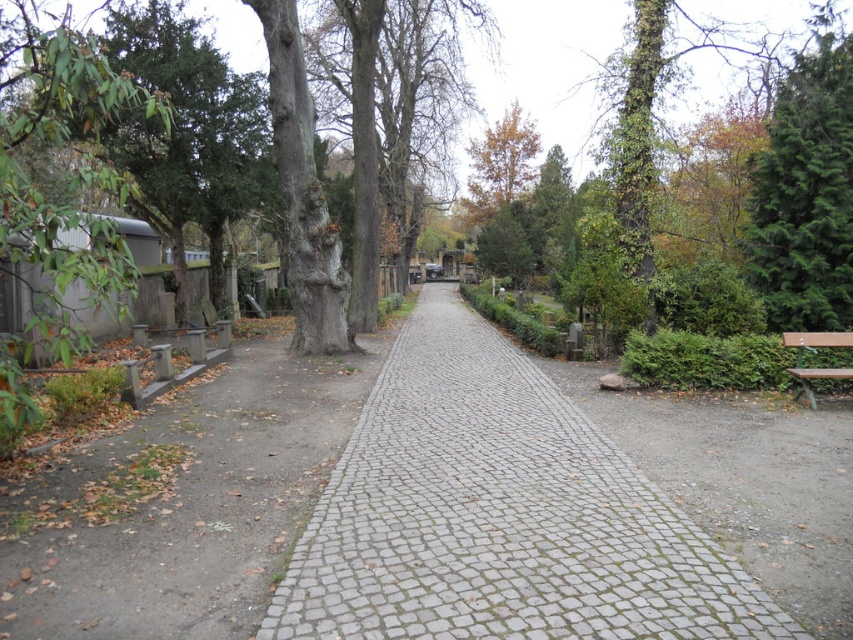
Does gray cobblestone path at center have a lesser height compared to green textured evergreen tree at right?

Yes, gray cobblestone path at center is shorter than green textured evergreen tree at right.

Is gray cobblestone path at center closer to the viewer compared to green textured evergreen tree at right?

Yes, gray cobblestone path at center is in front of green textured evergreen tree at right.

Between point (531, 396) and point (839, 145), which one is positioned in front?

Positioned in front is point (531, 396).

You are a GUI agent. You are given a task and a screenshot of the screen. Output one action in this format:
    pyautogui.click(x=<x>, y=<y>)
    Task: Click on the gray cobblestone path at center
    
    Given the screenshot: What is the action you would take?
    pyautogui.click(x=498, y=515)

Does green textured evergreen tree at right come behind brown wooden bench at right?

Yes, green textured evergreen tree at right is further from the viewer.

Between green textured evergreen tree at right and brown wooden bench at right, which one appears on the left side from the viewer's perspective?

brown wooden bench at right is more to the left.

Measure the distance between green textured evergreen tree at right and camera.

They are 39.63 feet apart.

Find the location of a particular element. green textured evergreen tree at right is located at coordinates (805, 193).

At what (x,y) coordinates should I click in order to perform the action: click on gray cobblestone path at center. Please return your answer as a coordinate pair (x, y). The width and height of the screenshot is (853, 640). Looking at the image, I should click on (498, 515).

Locate an element on the screen. gray cobblestone path at center is located at coordinates pos(498,515).

The height and width of the screenshot is (640, 853). What are the coordinates of `gray cobblestone path at center` in the screenshot? It's located at (x=498, y=515).